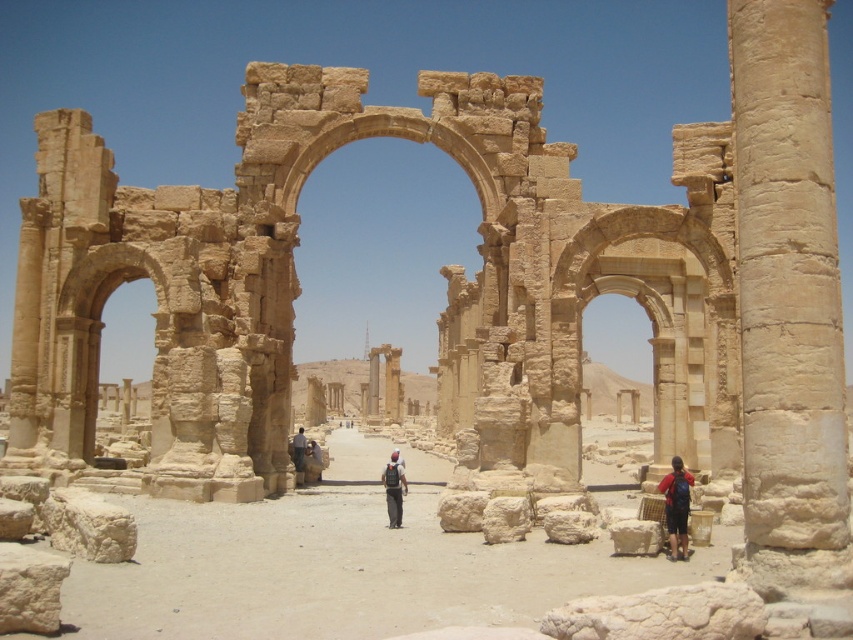
Question: Among these points, which one is nearest to the camera?

Choices:
 (A) (764, 403)
 (B) (76, 369)
 (C) (392, 518)
 (D) (668, 496)

Answer: (A)

Question: Estimate the real-world distances between objects in this image. Which object is closer to the matte red backpack at lower right?

Choices:
 (A) dark gray backpack at center
 (B) beige stone column at right

Answer: (B)

Question: Based on their relative distances, which object is nearer to the beige stone column at right?

Choices:
 (A) beige stone archway at center
 (B) dark gray backpack at center

Answer: (A)

Question: Does beige stone column at right lie in front of beige stone archway at left?

Choices:
 (A) no
 (B) yes

Answer: (B)

Question: Is beige stone archway at center positioned in front of beige stone archway at left?

Choices:
 (A) yes
 (B) no

Answer: (A)

Question: Is matte red backpack at lower right wider than dark gray backpack at center?

Choices:
 (A) no
 (B) yes

Answer: (B)